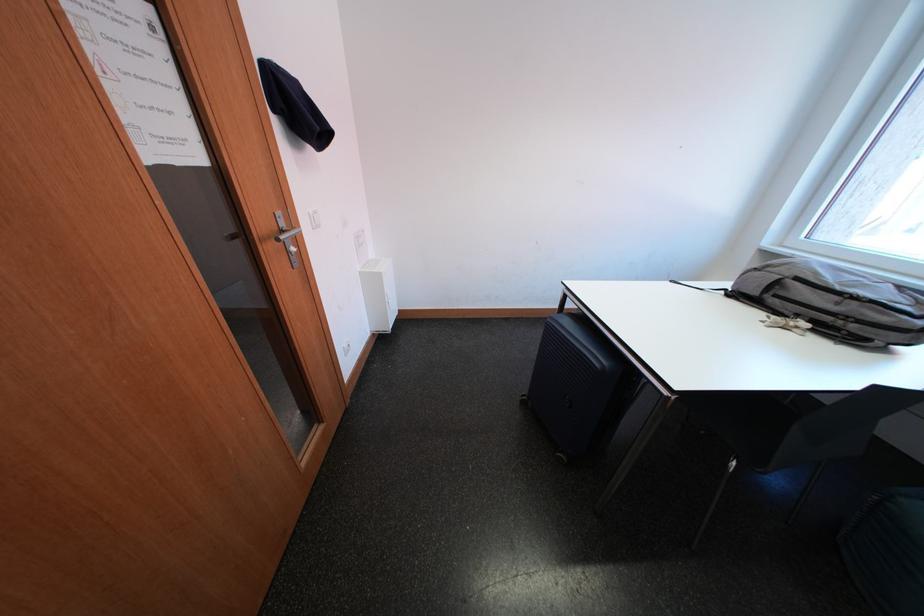
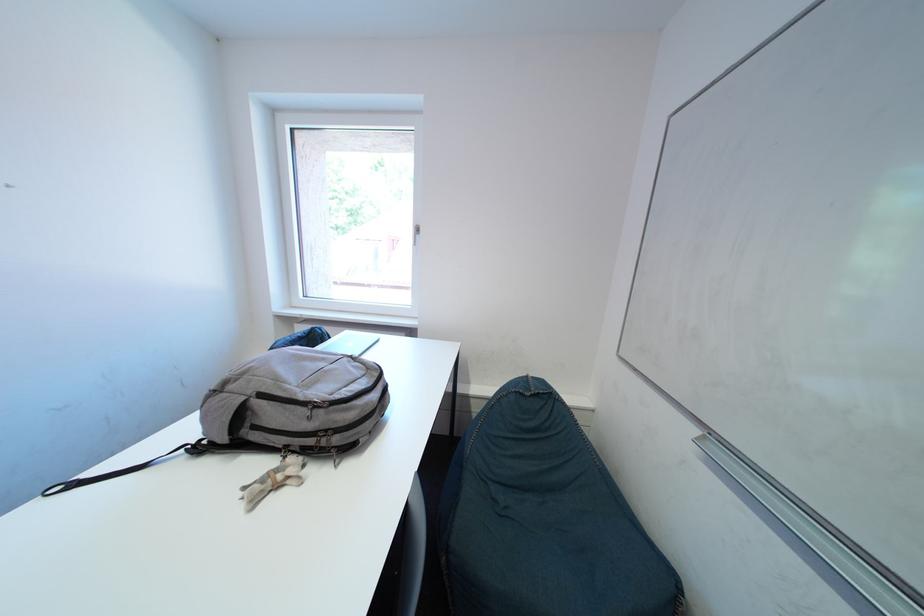
Question: The camera is either moving clockwise (left) or counter-clockwise (right) around the object. The first image is from the beginning of the video and the second image is from the end. Is the camera moving left or right when shooting the video?

Choices:
 (A) Left
 (B) Right

Answer: (A)